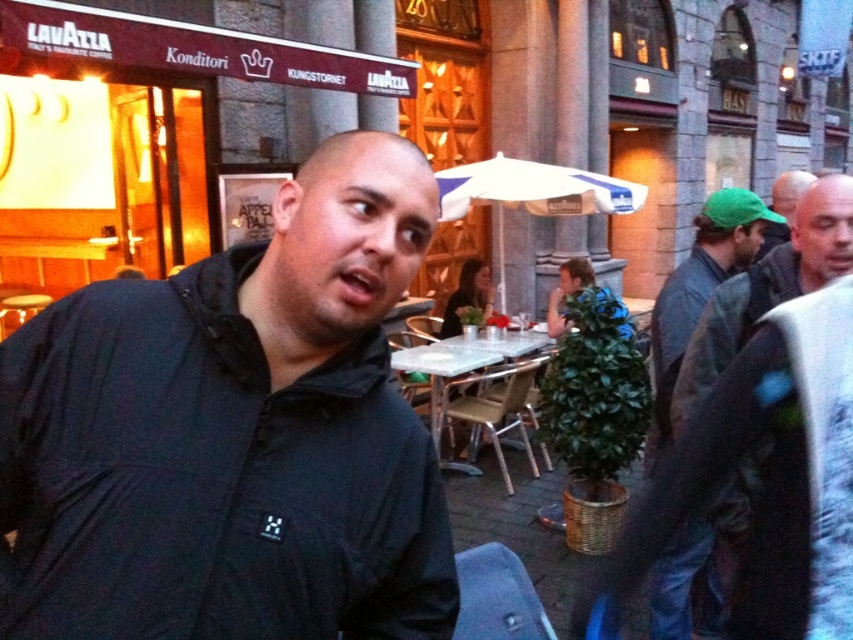
Question: Among these points, which one is farthest from the camera?

Choices:
 (A) (538, 205)
 (B) (300, 372)

Answer: (A)

Question: Is the position of black matte jacket at center more distant than that of white fabric umbrella at center?

Choices:
 (A) yes
 (B) no

Answer: (B)

Question: Which of the following is the farthest from the observer?

Choices:
 (A) black matte jacket at center
 (B) green fabric cap at upper right
 (C) white fabric umbrella at center
 (D) green fabric jacket at right

Answer: (C)

Question: Does black matte jacket at center appear on the right side of green fabric cap at upper right?

Choices:
 (A) no
 (B) yes

Answer: (A)

Question: Does black matte jacket at center appear on the left side of white fabric umbrella at center?

Choices:
 (A) yes
 (B) no

Answer: (A)

Question: Estimate the real-world distances between objects in this image. Which object is closer to the green fabric cap at upper right?

Choices:
 (A) white fabric umbrella at center
 (B) black matte jacket at center

Answer: (B)